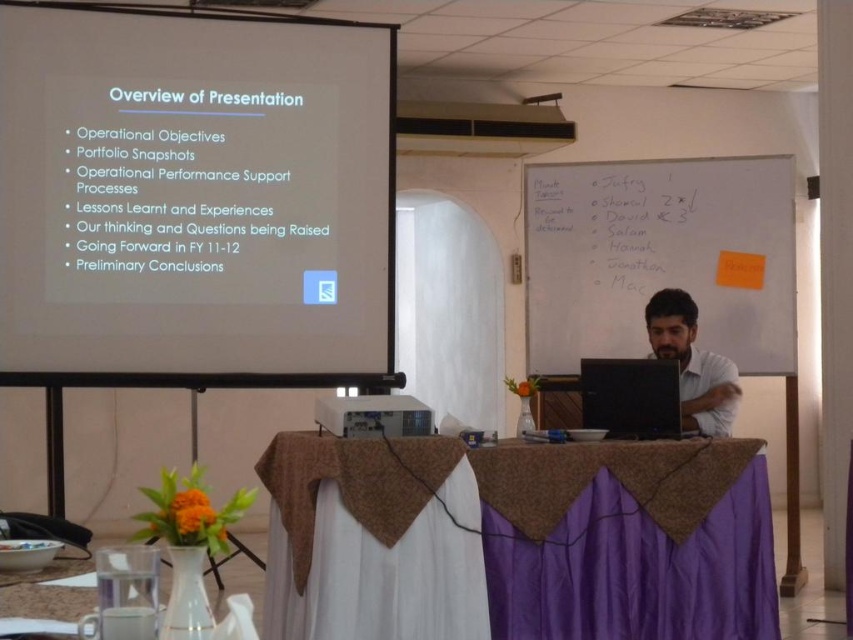
You are a GUI agent. You are given a task and a screenshot of the screen. Output one action in this format:
    pyautogui.click(x=<x>, y=<y>)
    Task: Click on the black glossy laptop at center
    This screenshot has height=640, width=853.
    Given the screenshot: What is the action you would take?
    pyautogui.click(x=630, y=397)

Does black glossy laptop at center have a smaller size compared to white plastic projector at center?

Incorrect, black glossy laptop at center is not smaller in size than white plastic projector at center.

The height and width of the screenshot is (640, 853). What do you see at coordinates (630, 397) in the screenshot?
I see `black glossy laptop at center` at bounding box center [630, 397].

Locate an element on the screen. Image resolution: width=853 pixels, height=640 pixels. black glossy laptop at center is located at coordinates click(630, 397).

Is purple fabric-covered table at center to the right of matte white shirt at right from the viewer's perspective?

In fact, purple fabric-covered table at center is to the left of matte white shirt at right.

Is point (741, 476) positioned before point (691, 403)?

Yes, point (741, 476) is closer to viewer.

At what (x,y) coordinates should I click in order to perform the action: click on purple fabric-covered table at center. Please return your answer as a coordinate pair (x, y). The height and width of the screenshot is (640, 853). Looking at the image, I should click on (517, 540).

In the scene shown: Does whiteboard at upper right appear under matte white shirt at right?

Incorrect, whiteboard at upper right is not positioned below matte white shirt at right.

Is whiteboard at upper right smaller than matte white shirt at right?

Incorrect, whiteboard at upper right is not smaller in size than matte white shirt at right.

Identify the location of whiteboard at upper right. The image size is (853, 640). point(660,257).

Identify the location of whiteboard at upper right. [660, 257].